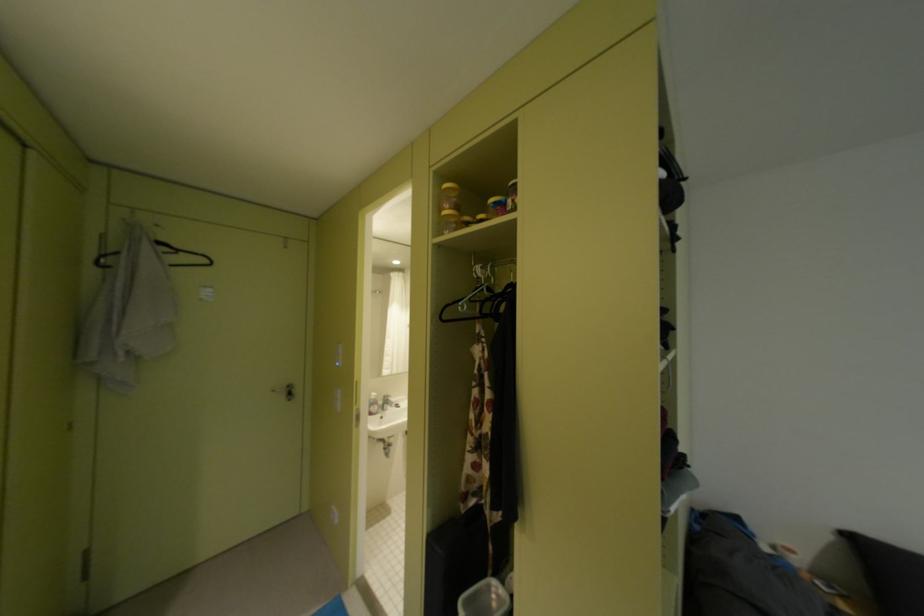
The location [372,403] corresponds to which object?

It refers to a white pump bottle.